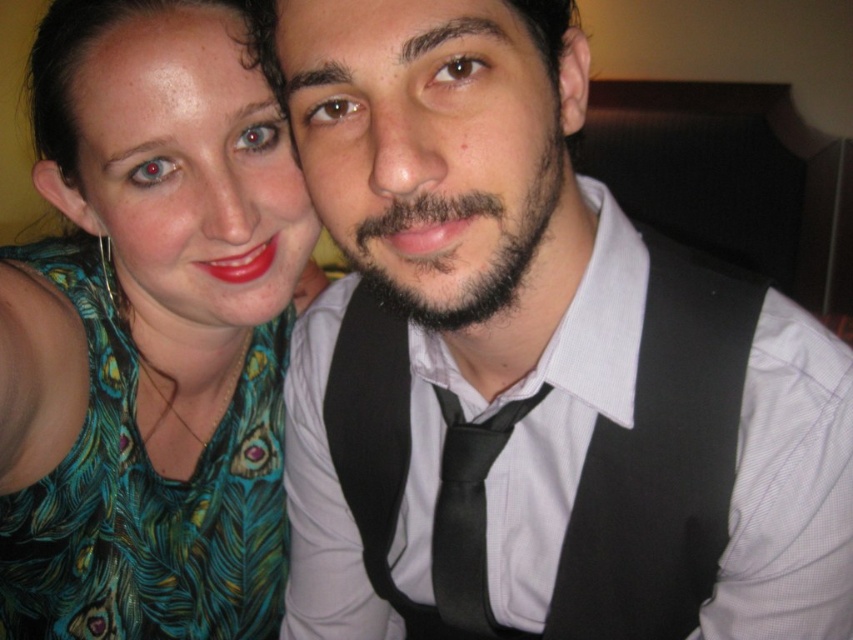
You are a photographer adjusting the lighting for a portrait. You notice the green feathered dress at left and the black satin tie at center. Which object is covering part of the other?

The green feathered dress at left is positioned over the black satin tie at center, so it is covering part of it.

You are a photographer setting up for a portrait. You have a camera with a focal length of 50mm and want to ensure the green feathered dress at left is in focus. What is the minimum distance you should be from the dress to achieve sharp focus?

The green feathered dress at left is 21.07 inches away from camera. To ensure sharp focus with a 50mm lens, the photographer should maintain a distance of at least 21.07 inches from the dress.

You are a photographer setting up for a portrait. You notice the black fabric vest at center and the black satin tie at center. Which one is covering the other?

The black fabric vest at center is positioned over the black satin tie at center, so the vest is covering the tie.